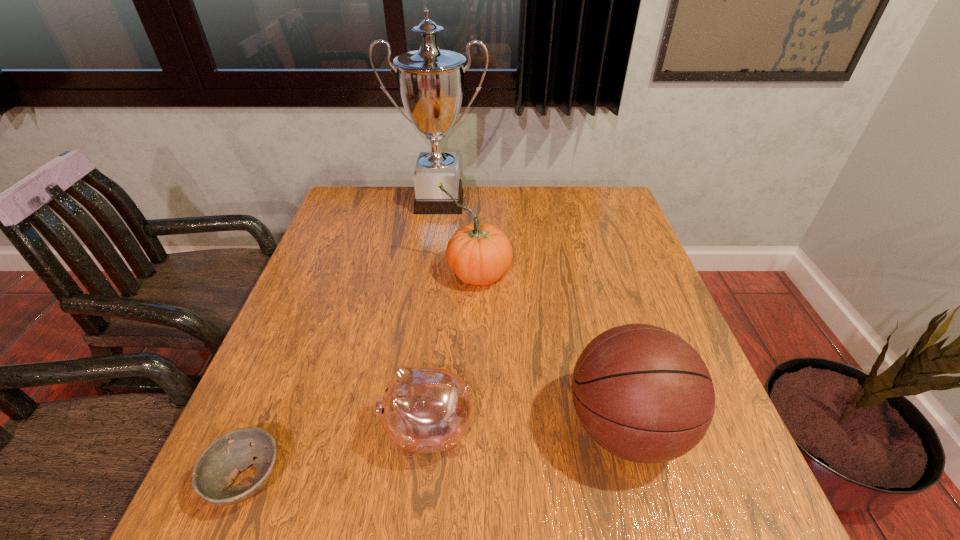
Find the location of a particular element. The image size is (960, 540). free space located on the front facing side of the second shortest object is located at coordinates (271, 431).

Identify the location of vacant region located 0.260m on the front facing side of the second shortest object. (244, 431).

This screenshot has width=960, height=540. I want to click on free location located 0.150m on the front facing side of the second shortest object, so click(x=302, y=431).

This screenshot has height=540, width=960. Find the location of `blank area located on the right of the shortest object`. blank area located on the right of the shortest object is located at coordinates (464, 480).

What are the coordinates of `object that is at the far edge` in the screenshot? It's located at (431, 81).

I want to click on basketball positioned at the near edge, so click(x=644, y=394).

The width and height of the screenshot is (960, 540). Identify the location of bowl that is at the near edge. (219, 465).

At what (x,y) coordinates should I click in order to perform the action: click on object that is at the left edge. Please return your answer as a coordinate pair (x, y). This screenshot has width=960, height=540. Looking at the image, I should click on (219, 465).

The width and height of the screenshot is (960, 540). In order to click on object that is at the right edge in this screenshot , I will do `click(644, 394)`.

At what (x,y) coordinates should I click in order to perform the action: click on object that is positioned at the near left corner. Please return your answer as a coordinate pair (x, y). Looking at the image, I should click on (219, 465).